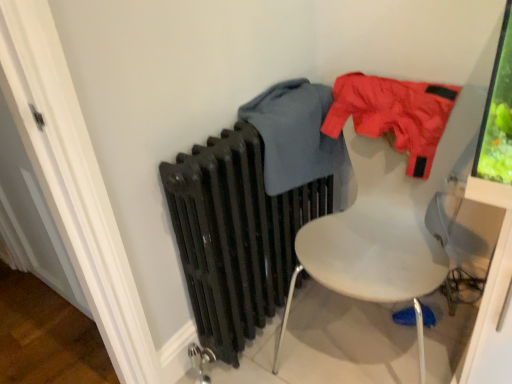
Question: From the image's perspective, is matte nylon jacket at upper right, which is the second clothing from left to right, beneath matte black radiator at center?

Choices:
 (A) no
 (B) yes

Answer: (A)

Question: Does matte nylon jacket at upper right, which is counted as the first clothing, starting from the right, have a greater width compared to matte black radiator at center?

Choices:
 (A) yes
 (B) no

Answer: (A)

Question: Considering the relative sizes of matte nylon jacket at upper right, which is counted as the first clothing, starting from the right, and matte black radiator at center in the image provided, is matte nylon jacket at upper right, which is counted as the first clothing, starting from the right, bigger than matte black radiator at center?

Choices:
 (A) no
 (B) yes

Answer: (A)

Question: From the image's perspective, is matte nylon jacket at upper right, which is counted as the first clothing, starting from the right, above matte black radiator at center?

Choices:
 (A) no
 (B) yes

Answer: (B)

Question: From a real-world perspective, is matte nylon jacket at upper right, which is the second clothing from left to right, on matte black radiator at center?

Choices:
 (A) no
 (B) yes

Answer: (B)

Question: From the image's perspective, is white plastic chair at upper right above or below matte gray sweater at center, positioned as the 1th clothing in left-to-right order?

Choices:
 (A) above
 (B) below

Answer: (B)

Question: From a real-world perspective, relative to matte gray sweater at center, which appears as the second clothing when viewed from the right, is white plastic chair at upper right vertically above or below?

Choices:
 (A) below
 (B) above

Answer: (A)

Question: Is white plastic chair at upper right bigger or smaller than matte gray sweater at center, positioned as the 1th clothing in left-to-right order?

Choices:
 (A) small
 (B) big

Answer: (B)

Question: In the image, is white plastic chair at upper right on the left side or the right side of matte gray sweater at center, which appears as the second clothing when viewed from the right?

Choices:
 (A) left
 (B) right

Answer: (B)

Question: From the image's perspective, is matte black radiator at center located above or below white plastic chair at upper right?

Choices:
 (A) above
 (B) below

Answer: (A)

Question: In the image, is matte black radiator at center positioned in front of or behind white plastic chair at upper right?

Choices:
 (A) front
 (B) behind

Answer: (B)

Question: Considering the positions of matte black radiator at center and white plastic chair at upper right in the image, is matte black radiator at center bigger or smaller than white plastic chair at upper right?

Choices:
 (A) small
 (B) big

Answer: (A)

Question: Is matte black radiator at center inside the boundaries of white plastic chair at upper right, or outside?

Choices:
 (A) outside
 (B) inside

Answer: (A)

Question: Is matte gray sweater at center, which appears as the second clothing when viewed from the right, taller or shorter than matte nylon jacket at upper right, which is counted as the first clothing, starting from the right?

Choices:
 (A) tall
 (B) short

Answer: (A)

Question: Considering the positions of matte gray sweater at center, positioned as the 1th clothing in left-to-right order, and matte nylon jacket at upper right, which is counted as the first clothing, starting from the right, in the image, is matte gray sweater at center, positioned as the 1th clothing in left-to-right order, bigger or smaller than matte nylon jacket at upper right, which is counted as the first clothing, starting from the right,?

Choices:
 (A) big
 (B) small

Answer: (A)